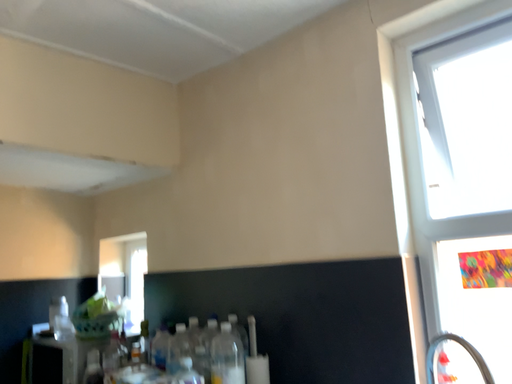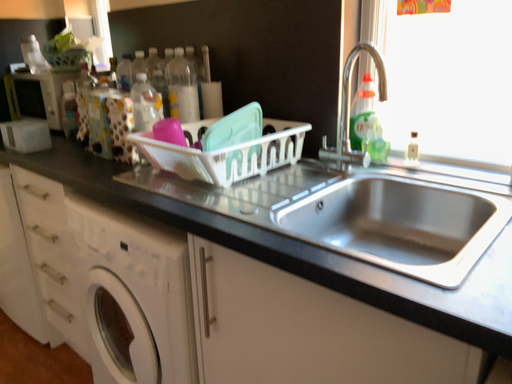
Question: How did the camera likely rotate when shooting the video?

Choices:
 (A) rotated downward
 (B) rotated upward

Answer: (A)